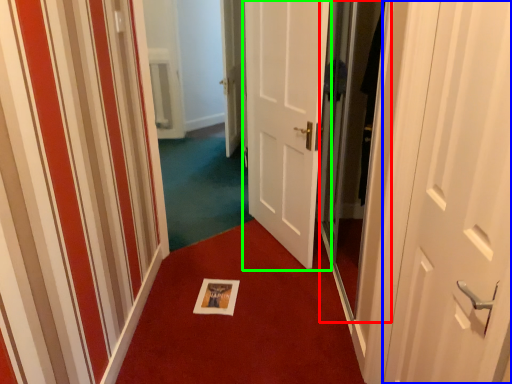
Question: Considering the real-world distances, which object is farthest from screen door (highlighted by a red box)? door (highlighted by a blue box) or door (highlighted by a green box)?

Choices:
 (A) door
 (B) door

Answer: (A)